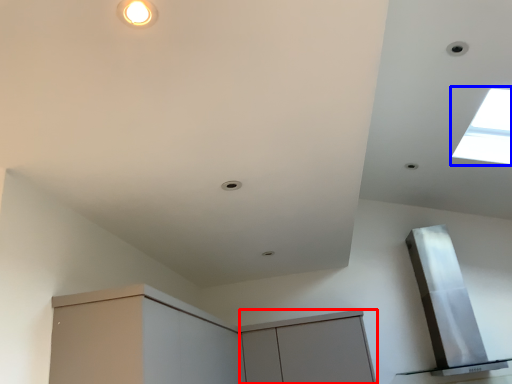
Question: Which object is closer to the camera taking this photo, cabinetry (highlighted by a red box) or window (highlighted by a blue box)?

Choices:
 (A) cabinetry
 (B) window

Answer: (B)